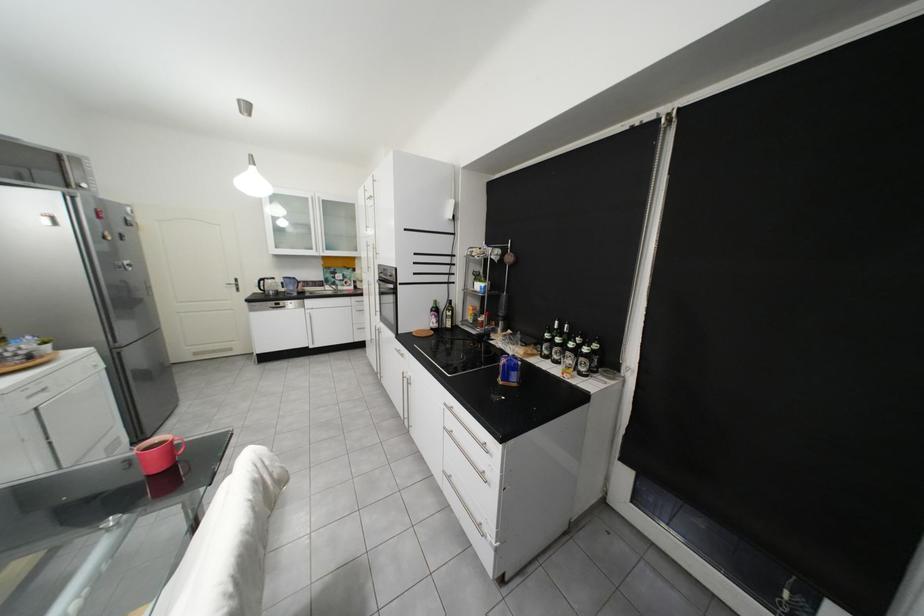
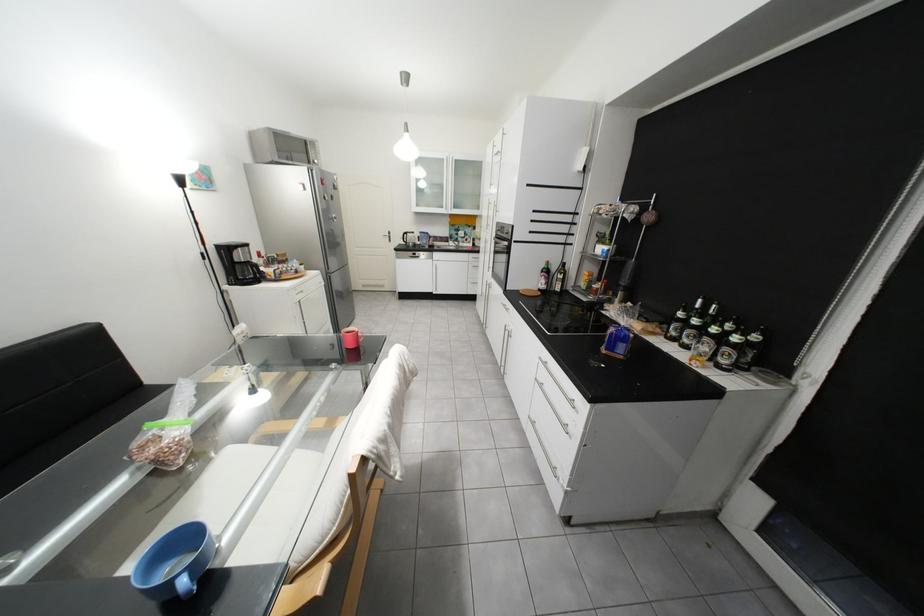
Where in the second image is the point corresponding to (441,477) from the first image?

(528, 419)